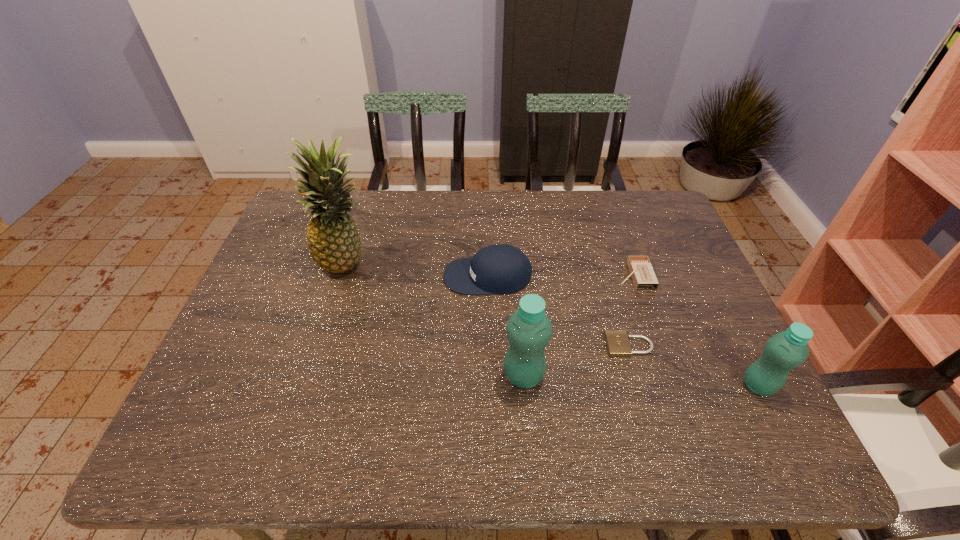
Locate an element on the screen. the left water bottle is located at coordinates (529, 330).

Identify the location of the second tallest object. The height and width of the screenshot is (540, 960). (529, 330).

I want to click on the right water bottle, so click(786, 350).

The image size is (960, 540). What are the coordinates of `the rightmost object` in the screenshot? It's located at (786, 350).

Find the location of a particular element. The width and height of the screenshot is (960, 540). the second shortest object is located at coordinates pyautogui.click(x=641, y=270).

Locate an element on the screen. the fourth farthest object is located at coordinates (617, 342).

At what (x,y) coordinates should I click in order to perform the action: click on the shortest object. Please return your answer as a coordinate pair (x, y). Looking at the image, I should click on (617, 342).

At what (x,y) coordinates should I click in order to perform the action: click on pineapple. Please return your answer as a coordinate pair (x, y). This screenshot has width=960, height=540. Looking at the image, I should click on (333, 240).

Identify the location of the leftmost object. The height and width of the screenshot is (540, 960). pyautogui.click(x=333, y=240).

Where is `baseball cap`? baseball cap is located at coordinates (503, 269).